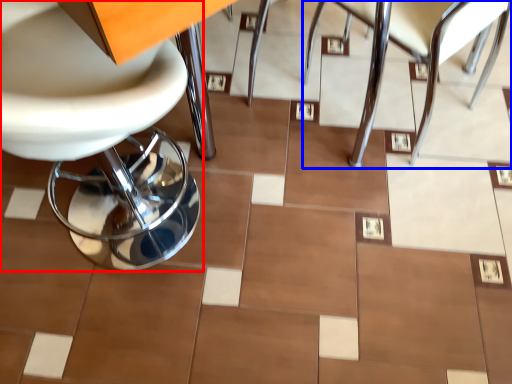
Question: Which of the following is the closest to the observer, chair (highlighted by a red box) or chair (highlighted by a blue box)?

Choices:
 (A) chair
 (B) chair

Answer: (A)